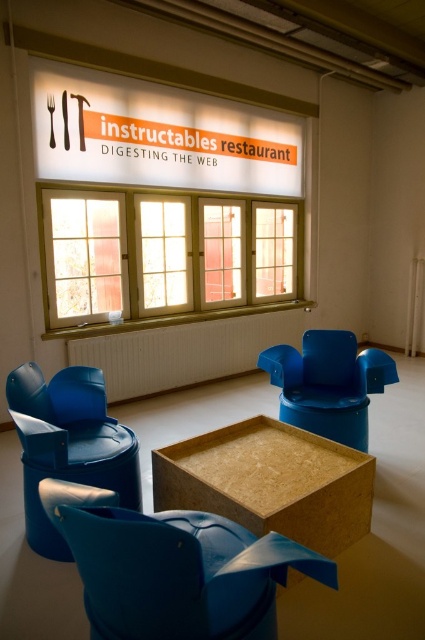
Find the location of a particular element. blue plastic swivel chair at lower left is located at coordinates (173, 568).

Does blue plastic swivel chair at lower left have a smaller size compared to wooden frame window at center?

Yes, blue plastic swivel chair at lower left is smaller than wooden frame window at center.

Is point (138, 576) positioned behind point (254, 269)?

No, it is not.

Locate an element on the screen. The width and height of the screenshot is (425, 640). blue plastic swivel chair at lower left is located at coordinates (173, 568).

Who is lower down, matte blue armchair at lower left or blue plastic chair at center?

matte blue armchair at lower left is below.

Does point (22, 387) lie behind point (272, 365)?

That is False.

Image resolution: width=425 pixels, height=640 pixels. I want to click on matte blue armchair at lower left, so click(68, 444).

Is wooden-framed window at center above wooden frame window at center?

No, wooden-framed window at center is not above wooden frame window at center.

Does wooden-framed window at center appear under wooden frame window at center?

Correct, wooden-framed window at center is located below wooden frame window at center.

Is point (244, 218) positioned in front of point (254, 234)?

Yes, it is in front of point (254, 234).

Locate an element on the screen. wooden-framed window at center is located at coordinates (164, 257).